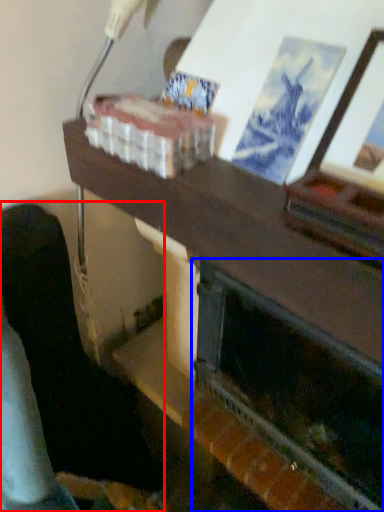
Question: Which object appears farthest to the camera in this image, furniture (highlighted by a red box) or fireplace (highlighted by a blue box)?

Choices:
 (A) furniture
 (B) fireplace

Answer: (A)